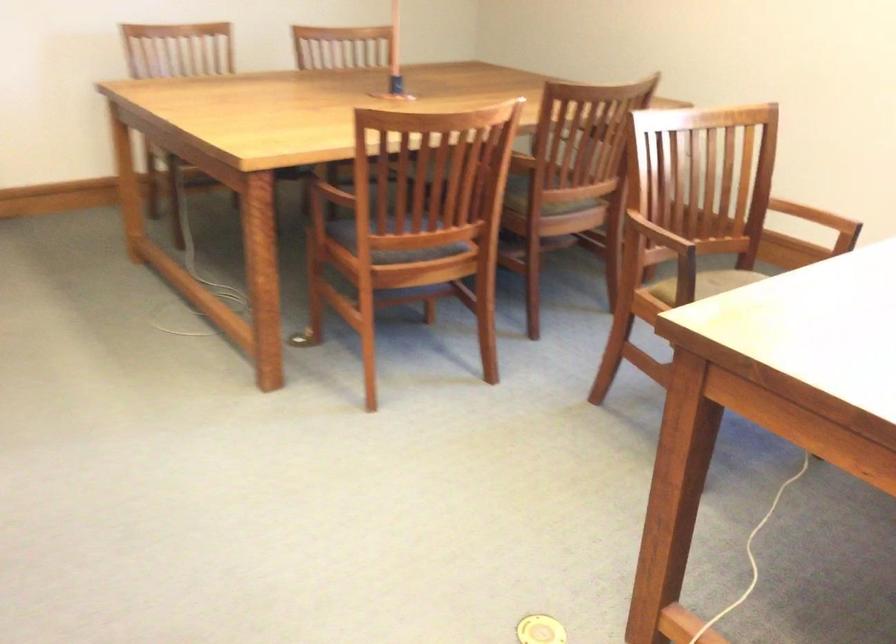
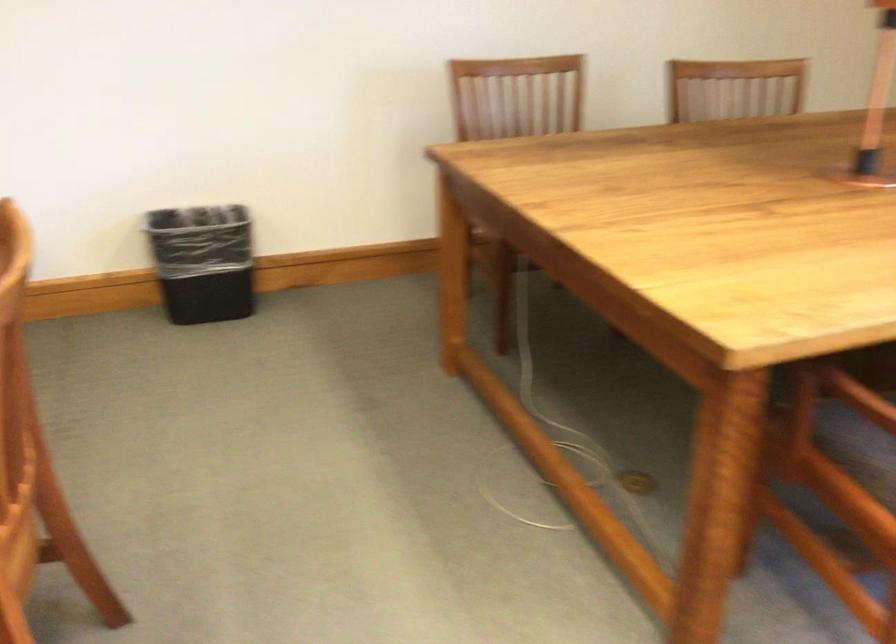
Locate, in the second image, the point that corresponds to (369,234) in the first image.

(885, 442)